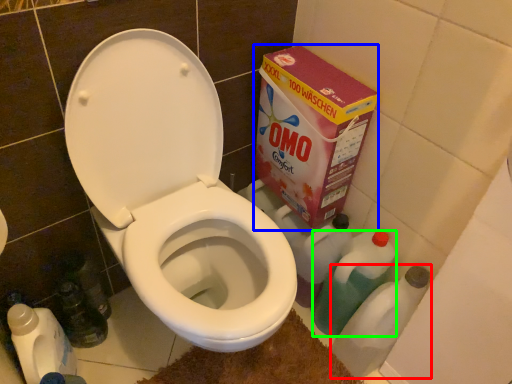
Question: Estimate the real-world distances between objects in this image. Which object is closer to bottle (highlighted by a red box), cardboard box (highlighted by a blue box) or cleaning product (highlighted by a green box)?

Choices:
 (A) cardboard box
 (B) cleaning product

Answer: (B)